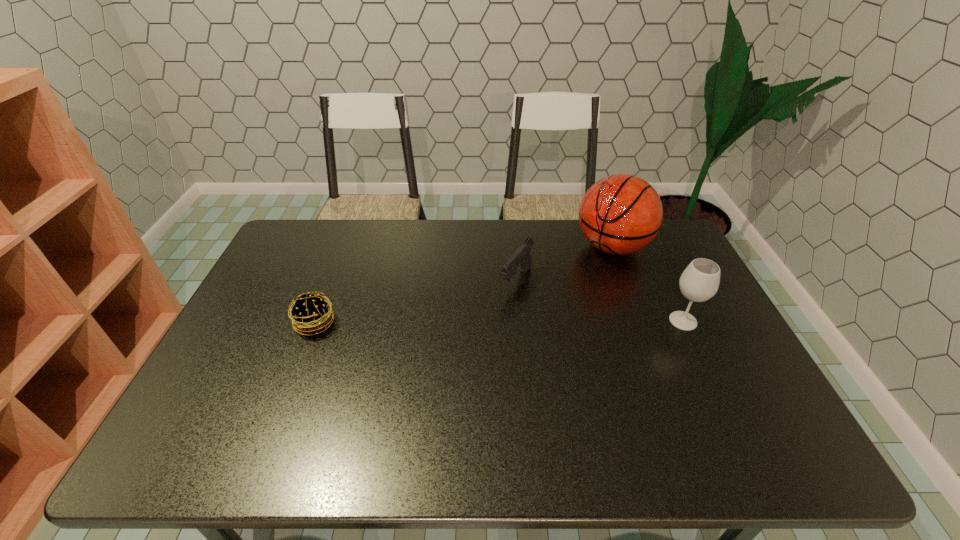
At what (x,y) coordinates should I click in order to perform the action: click on vacant space in between the shortest object and the wineglass. Please return your answer as a coordinate pair (x, y). This screenshot has height=540, width=960. Looking at the image, I should click on (499, 322).

Image resolution: width=960 pixels, height=540 pixels. I want to click on vacant region between the third tallest object and the wineglass, so 599,301.

Where is `vacant area that lies between the tallest object and the wineglass`? The height and width of the screenshot is (540, 960). vacant area that lies between the tallest object and the wineglass is located at coordinates (648, 284).

Identify the location of vacant space in between the basketball and the second tallest object. (648, 284).

Locate which object is the second closest to the second shortest object. Please provide its 2D coordinates. Your answer should be formatted as a tuple, i.e. [(x, y)], where the tuple contains the x and y coordinates of a point satisfying the conditions above.

[(699, 282)]

At what (x,y) coordinates should I click in order to perform the action: click on object that is the second closest one to the shortest object. Please return your answer as a coordinate pair (x, y). Looking at the image, I should click on (620, 214).

Identify the location of free point that satisfies the following two spatial constraints: 1. on the back side of the leftmost object; 2. on the left side of the wineglass. The image size is (960, 540). (316, 321).

Find the location of a particular element. vacant region that satisfies the following two spatial constraints: 1. on the back side of the leftmost object; 2. on the right side of the basketball is located at coordinates point(344,247).